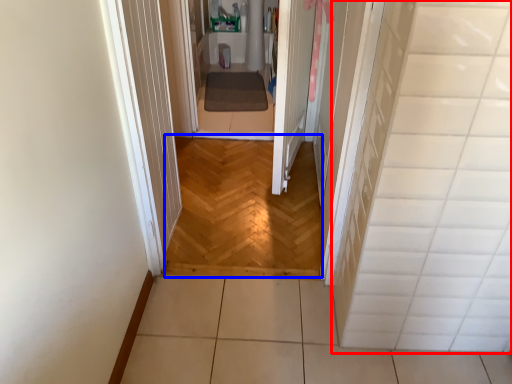
Question: Which object is further to the camera taking this photo, tile (highlighted by a red box) or corridor (highlighted by a blue box)?

Choices:
 (A) tile
 (B) corridor

Answer: (B)